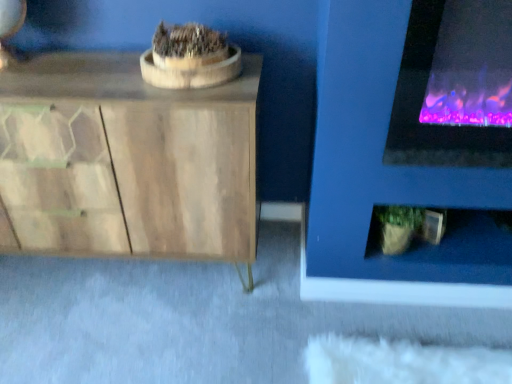
At what (x,y) coordinates should I click in order to perform the action: click on wooden cabinet at left. Please return your answer as a coordinate pair (x, y). This screenshot has width=512, height=384. Looking at the image, I should click on (126, 161).

Measure the distance between wooden cabinet at left and camera.

The depth of wooden cabinet at left is 3.45 feet.

Image resolution: width=512 pixels, height=384 pixels. What do you see at coordinates (126, 161) in the screenshot? I see `wooden cabinet at left` at bounding box center [126, 161].

You are a GUI agent. You are given a task and a screenshot of the screen. Output one action in this format:
    pyautogui.click(x=<x>, y=<y>)
    Task: Click on the wooden cabinet at left
    The height and width of the screenshot is (384, 512).
    Given the screenshot: What is the action you would take?
    pyautogui.click(x=126, y=161)